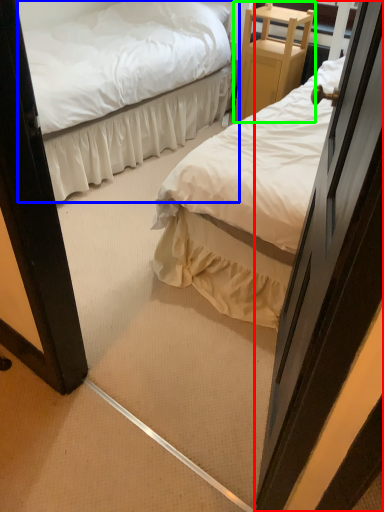
Question: Considering the real-world distances, which object is closest to door (highlighted by a red box)? bed (highlighted by a blue box) or furniture (highlighted by a green box).

Choices:
 (A) bed
 (B) furniture

Answer: (A)